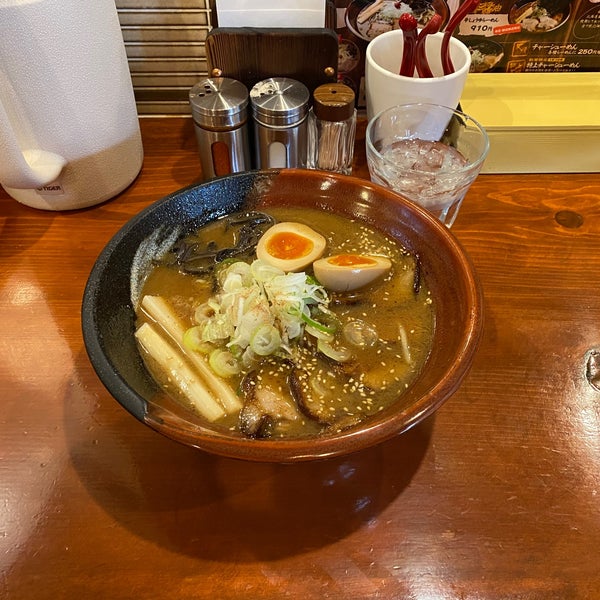
This screenshot has height=600, width=600. Find the location of `styrofoam cup`. styrofoam cup is located at coordinates (395, 87).